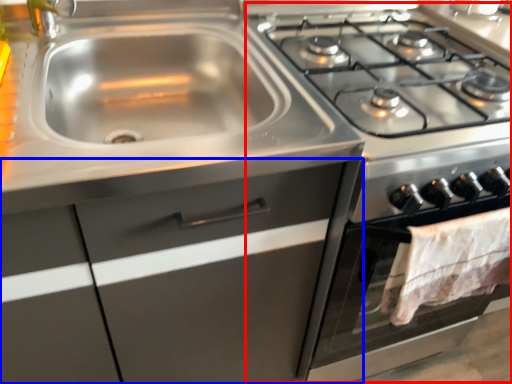
Question: Which object appears closest to the camera in this image, appliance (highlighted by a red box) or cabinetry (highlighted by a blue box)?

Choices:
 (A) appliance
 (B) cabinetry

Answer: (B)